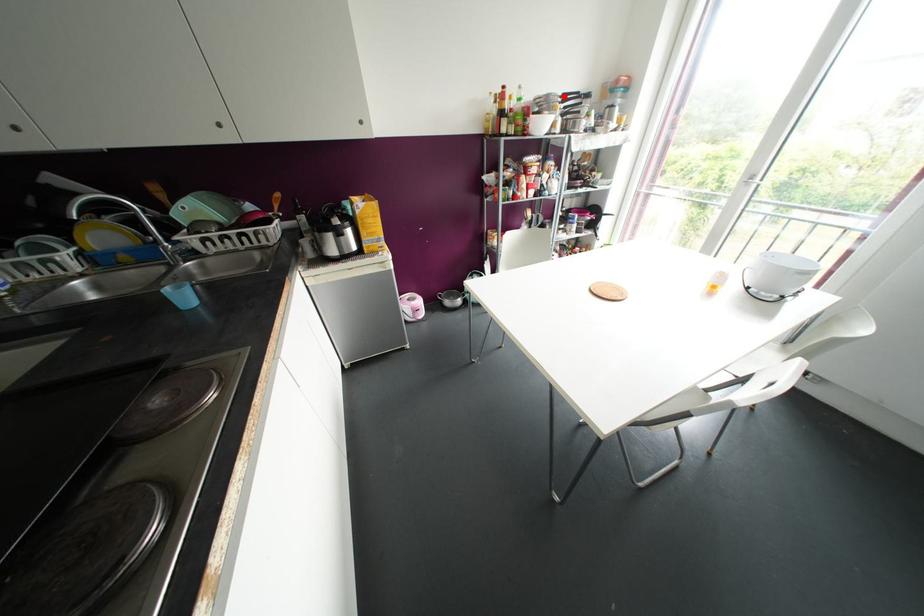
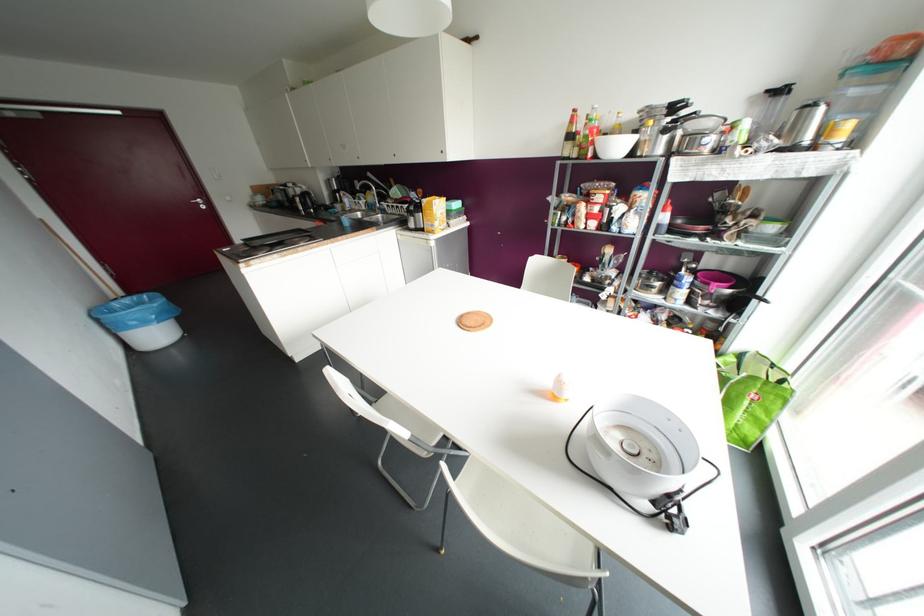
Locate, in the second image, the point that corresponds to the highlighted location in the first image.

(673, 107)